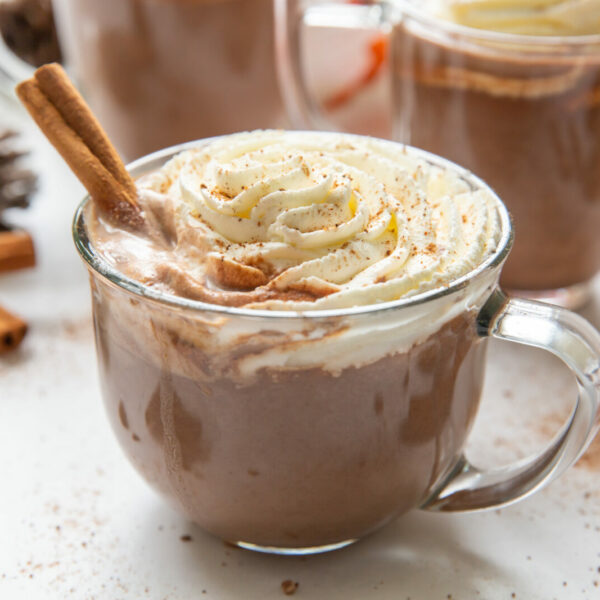
Where is `mug`? The image size is (600, 600). mug is located at coordinates (543, 120).